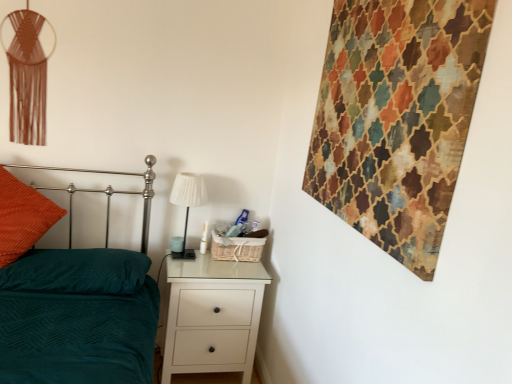
Question: Is teal fabric pillow at lower left closer to camera compared to white glossy chest of drawers at lower center?

Choices:
 (A) yes
 (B) no

Answer: (A)

Question: From the image's perspective, is teal fabric pillow at lower left below white glossy chest of drawers at lower center?

Choices:
 (A) no
 (B) yes

Answer: (A)

Question: Considering the relative sizes of teal fabric pillow at lower left and white glossy chest of drawers at lower center in the image provided, is teal fabric pillow at lower left thinner than white glossy chest of drawers at lower center?

Choices:
 (A) no
 (B) yes

Answer: (A)

Question: Is teal fabric pillow at lower left positioned beyond the bounds of white glossy chest of drawers at lower center?

Choices:
 (A) no
 (B) yes

Answer: (B)

Question: Does teal fabric pillow at lower left appear on the left side of white glossy chest of drawers at lower center?

Choices:
 (A) no
 (B) yes

Answer: (B)

Question: Is teal fabric pillow at lower left further to camera compared to white glossy chest of drawers at lower center?

Choices:
 (A) yes
 (B) no

Answer: (B)

Question: From the image's perspective, does teal fabric bed at left appear lower than orange textured pillow at left?

Choices:
 (A) yes
 (B) no

Answer: (A)

Question: Does teal fabric bed at left appear on the left side of orange textured pillow at left?

Choices:
 (A) yes
 (B) no

Answer: (B)

Question: Does teal fabric bed at left have a greater height compared to orange textured pillow at left?

Choices:
 (A) no
 (B) yes

Answer: (B)

Question: Does teal fabric bed at left touch orange textured pillow at left?

Choices:
 (A) yes
 (B) no

Answer: (B)

Question: From the image's perspective, is teal fabric bed at left above orange textured pillow at left?

Choices:
 (A) no
 (B) yes

Answer: (A)

Question: Considering the relative sizes of teal fabric bed at left and orange textured pillow at left in the image provided, is teal fabric bed at left shorter than orange textured pillow at left?

Choices:
 (A) no
 (B) yes

Answer: (A)

Question: Is white glossy chest of drawers at lower center taller than teal fabric pillow at lower left?

Choices:
 (A) no
 (B) yes

Answer: (B)